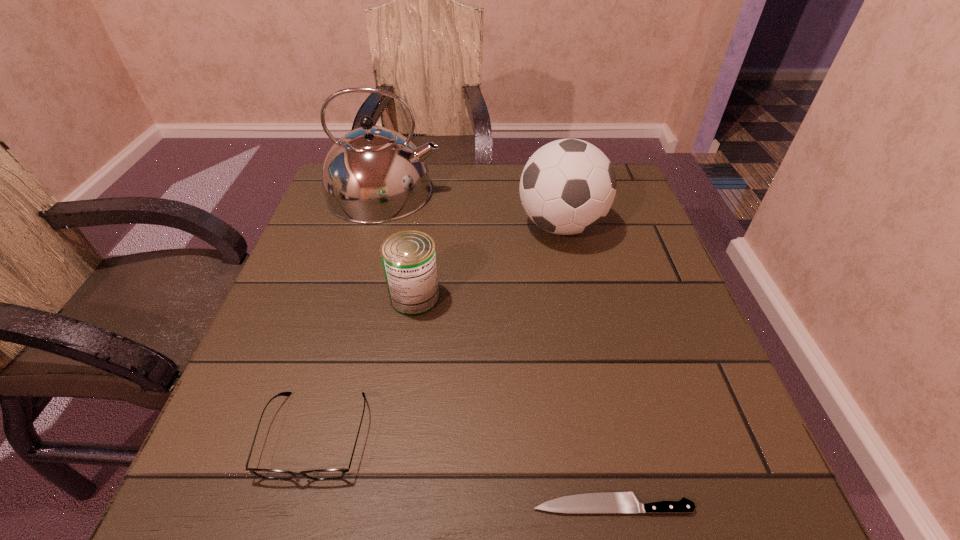
This screenshot has height=540, width=960. Find the location of `the tallest object`. the tallest object is located at coordinates (372, 175).

Where is `soccer ball`? This screenshot has height=540, width=960. soccer ball is located at coordinates (568, 186).

This screenshot has height=540, width=960. In order to click on the third tallest object in this screenshot , I will do `click(409, 258)`.

The image size is (960, 540). Find the location of `the third nearest object`. the third nearest object is located at coordinates (409, 258).

This screenshot has width=960, height=540. I want to click on the second shortest object, so click(322, 474).

Image resolution: width=960 pixels, height=540 pixels. Identify the location of spectacles. (322, 474).

Where is `the shortest object`? Image resolution: width=960 pixels, height=540 pixels. the shortest object is located at coordinates tap(597, 502).

At what (x,y) coordinates should I click in order to perform the action: click on the nearest object. Please return your answer as a coordinate pair (x, y). Image resolution: width=960 pixels, height=540 pixels. Looking at the image, I should click on (597, 502).

Locate an element on the screen. The width and height of the screenshot is (960, 540). vacant space located from the spout of the kettle is located at coordinates (530, 193).

The image size is (960, 540). I want to click on blank space located 0.370m on the front of the fourth shortest object, so click(x=600, y=406).